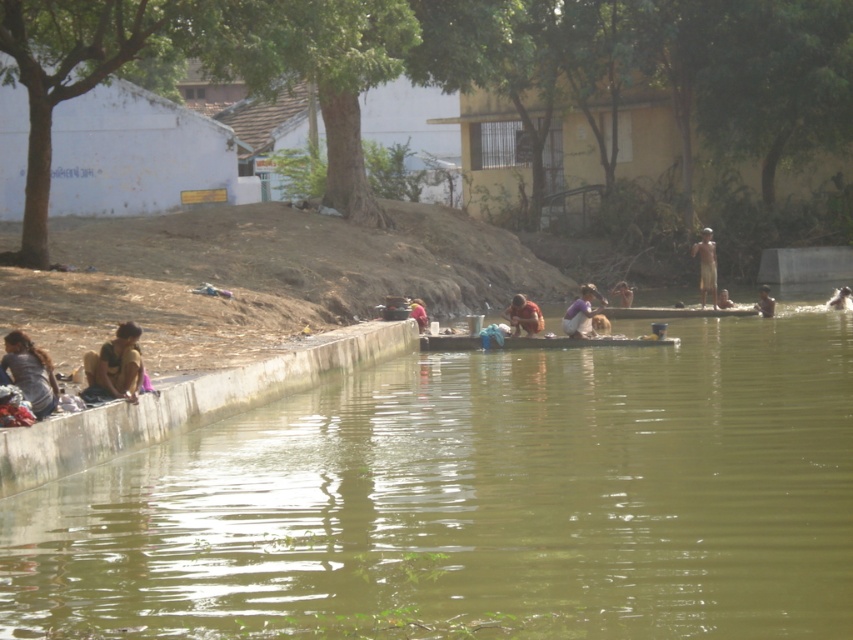
You are standing on the riverside and see the green murky water at center and the smooth skin person at center. Which object is closer to the left side of the image?

The green murky water at center is closer to the left side of the image because it is positioned to the left of the smooth skin person at center.